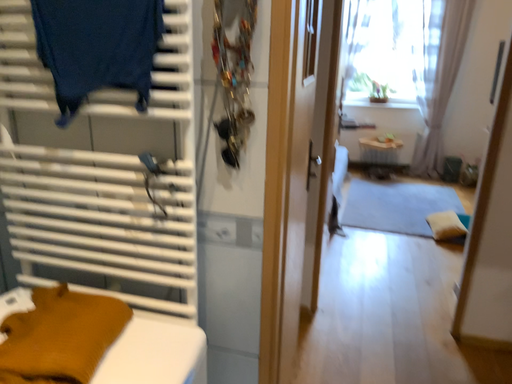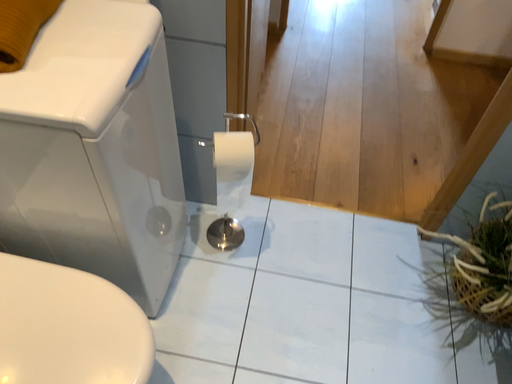
Question: Which way did the camera rotate in the video?

Choices:
 (A) rotated downward
 (B) rotated upward

Answer: (A)